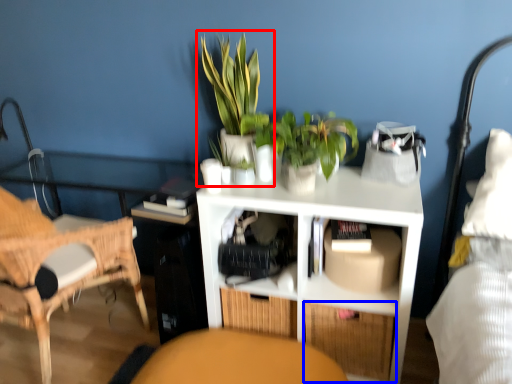
Question: Among these objects, which one is nearest to the camera, houseplant (highlighted by a red box) or drawer (highlighted by a blue box)?

Choices:
 (A) houseplant
 (B) drawer

Answer: (A)